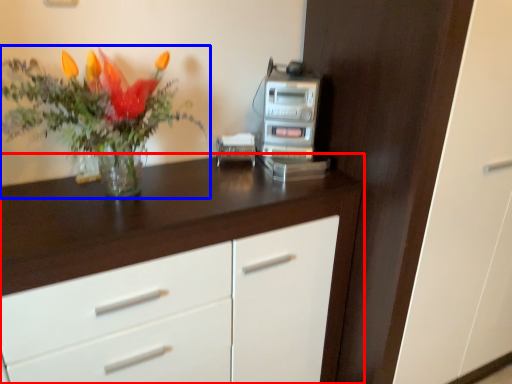
Question: Which object appears closest to the camera in this image, chest of drawers (highlighted by a red box) or houseplant (highlighted by a blue box)?

Choices:
 (A) chest of drawers
 (B) houseplant

Answer: (B)